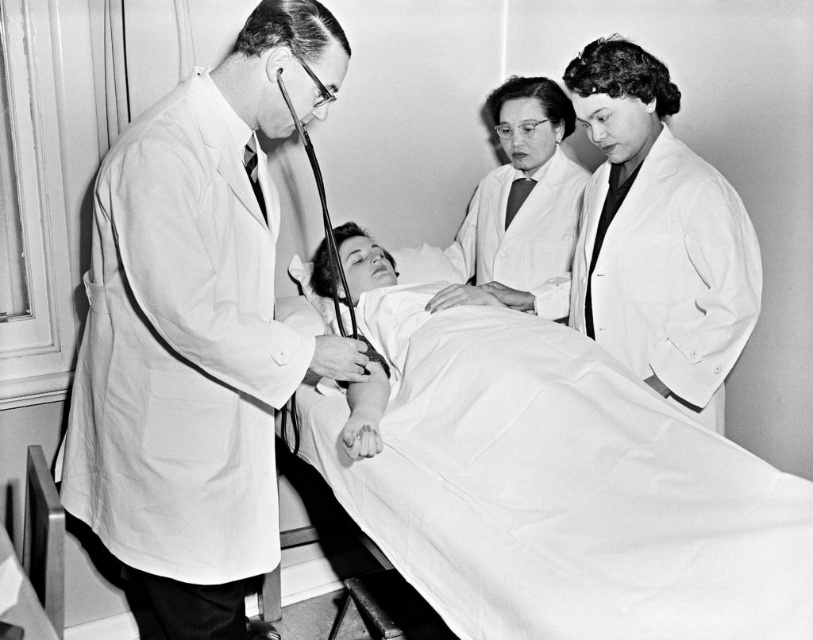
Does white smooth bed at center come in front of metallic smooth stethoscope at center?

Yes.

Does white smooth bed at center have a lesser height compared to metallic smooth stethoscope at center?

Incorrect, white smooth bed at center's height does not fall short of metallic smooth stethoscope at center's.

Who is more distant from viewer, (616, 502) or (337, 248)?

The point (337, 248) is behind.

Locate an element on the screen. white smooth bed at center is located at coordinates [555, 484].

Does white smooth bed at center appear under white lab coat at center?

Yes.

Who is lower down, white smooth bed at center or white lab coat at center?

Positioned lower is white smooth bed at center.

Where is `white smooth bed at center`? This screenshot has height=640, width=813. white smooth bed at center is located at coordinates (555, 484).

Is white lab coat at left thinner than metallic smooth stethoscope at center?

No.

This screenshot has width=813, height=640. What do you see at coordinates (196, 332) in the screenshot?
I see `white lab coat at left` at bounding box center [196, 332].

Between point (201, 173) and point (333, 284), which one is positioned in front?

Point (201, 173)

Locate an element on the screen. white lab coat at left is located at coordinates (196, 332).